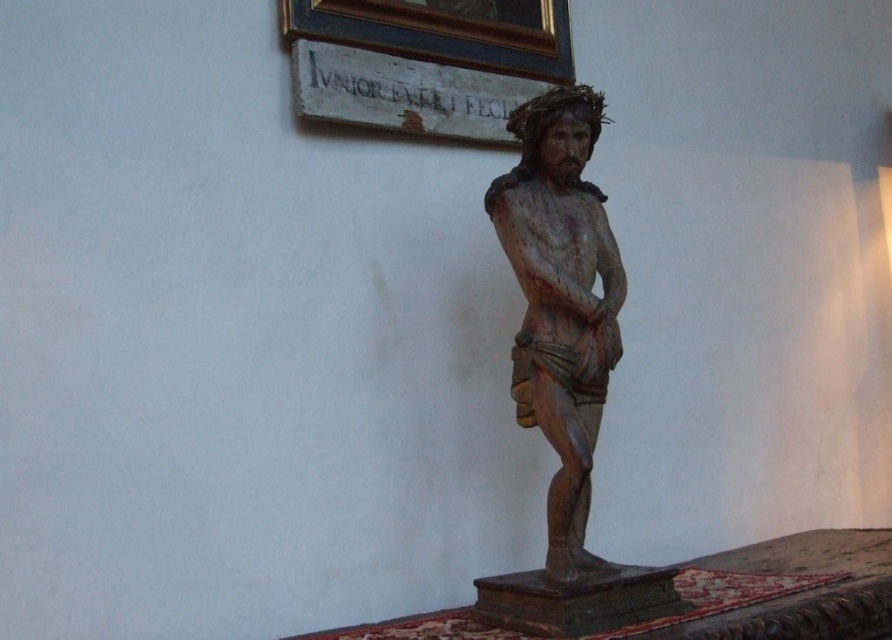
Which is behind, point (573, 545) or point (521, 3)?

The point (521, 3) is more distant.

Can you confirm if wooden statue at center is smaller than wooden plaque at upper center?

Incorrect, wooden statue at center is not smaller in size than wooden plaque at upper center.

What do you see at coordinates (564, 365) in the screenshot?
I see `wooden statue at center` at bounding box center [564, 365].

Find the location of `wooden statue at center`. wooden statue at center is located at coordinates [564, 365].